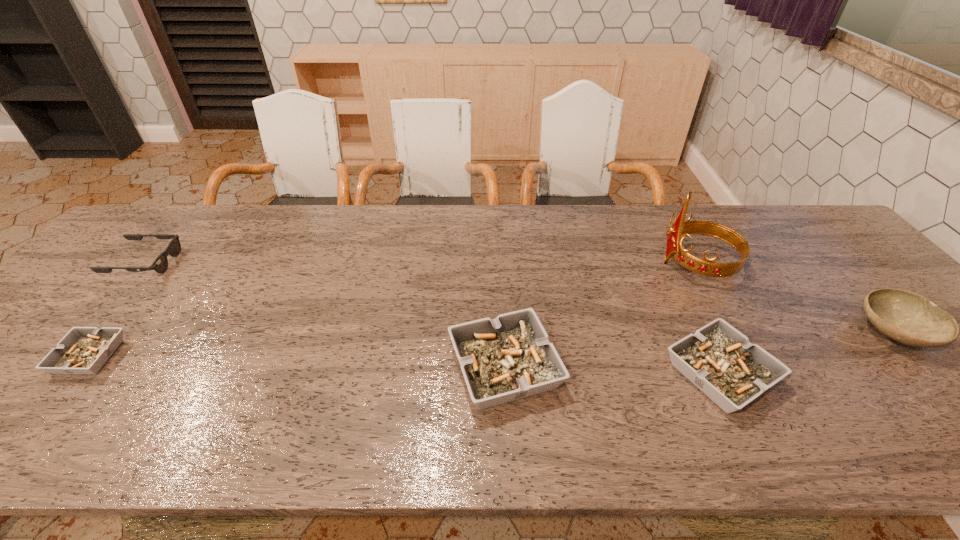
The height and width of the screenshot is (540, 960). Identify the location of the leftmost ashtray. (83, 350).

At what (x,y) coordinates should I click in order to perform the action: click on the shortest ashtray. Please return your answer as a coordinate pair (x, y). This screenshot has width=960, height=540. Looking at the image, I should click on (83, 350).

At what (x,y) coordinates should I click in order to perform the action: click on the second ashtray from left to right. Please return your answer as a coordinate pair (x, y). Looking at the image, I should click on (508, 358).

This screenshot has width=960, height=540. I want to click on the second tallest ashtray, so click(x=718, y=359).

The width and height of the screenshot is (960, 540). What are the coordinates of `tiara` in the screenshot? It's located at (680, 228).

Where is `sunglasses`? The width and height of the screenshot is (960, 540). sunglasses is located at coordinates (160, 264).

Where is `vacant space located 0.060m on the right of the leftmost ashtray`? vacant space located 0.060m on the right of the leftmost ashtray is located at coordinates (142, 357).

Find the location of a particular element. This screenshot has width=960, height=540. vacant space located 0.280m on the right of the second ashtray from right to left is located at coordinates (686, 368).

You are a GUI agent. You are given a task and a screenshot of the screen. Output one action in this format:
    pyautogui.click(x=<x>, y=<y>)
    Task: Click on the free spot located 0.050m on the right of the second shortest ashtray
    
    Given the screenshot: What is the action you would take?
    pyautogui.click(x=797, y=374)

Identify the location of free location located 0.400m on the front-facing side of the tallest object. Image resolution: width=960 pixels, height=540 pixels. (518, 264).